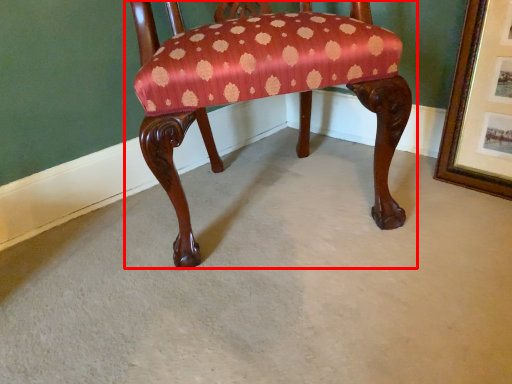
Question: From the image's perspective, what is the correct spatial positioning of chair (annotated by the red box) in reference to picture frame?

Choices:
 (A) below
 (B) above

Answer: (B)